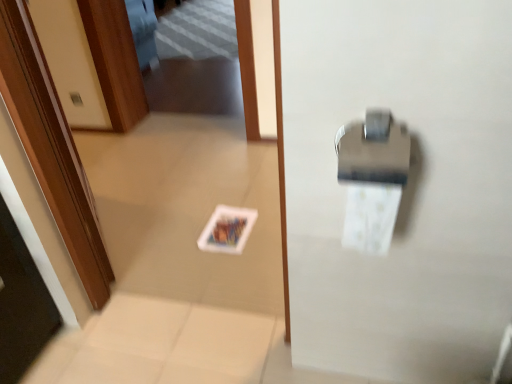
Image resolution: width=512 pixels, height=384 pixels. What are the coordinates of `spots to the right of wooden screen door at left` in the screenshot? It's located at (179, 232).